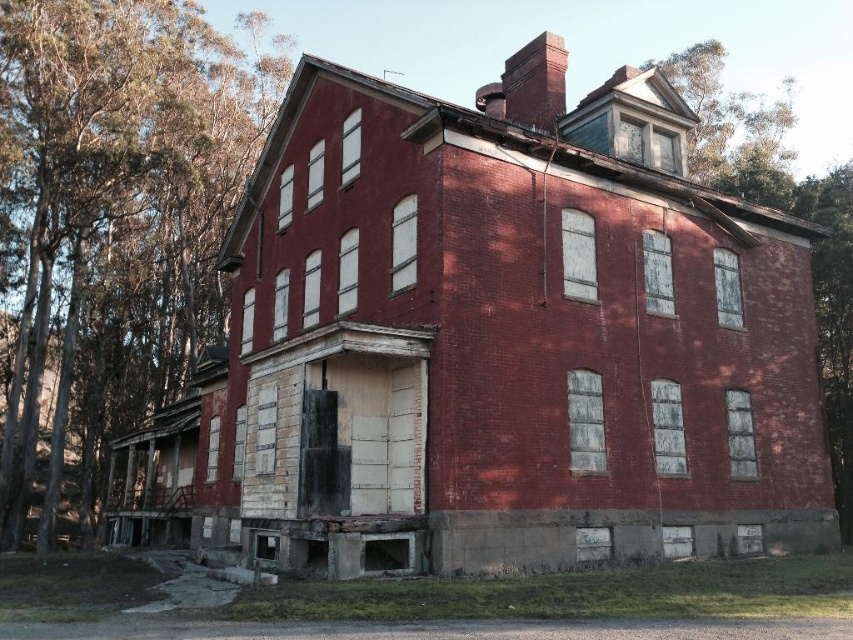
Question: Which of the following is the farthest from the observer?

Choices:
 (A) (850, 460)
 (B) (194, 355)

Answer: (B)

Question: Does green leafy tree at left appear under smooth bark tree at upper right?

Choices:
 (A) no
 (B) yes

Answer: (A)

Question: Does green leafy tree at left lie in front of smooth bark tree at upper right?

Choices:
 (A) yes
 (B) no

Answer: (B)

Question: Which of the following is the closest to the observer?

Choices:
 (A) (163, 60)
 (B) (740, 92)

Answer: (A)

Question: Which point appears closest to the camera in this image?

Choices:
 (A) (113, 112)
 (B) (834, 220)

Answer: (B)

Question: Where is green leafy tree at left located in relation to smooth bark tree at upper right in the image?

Choices:
 (A) above
 (B) below

Answer: (A)